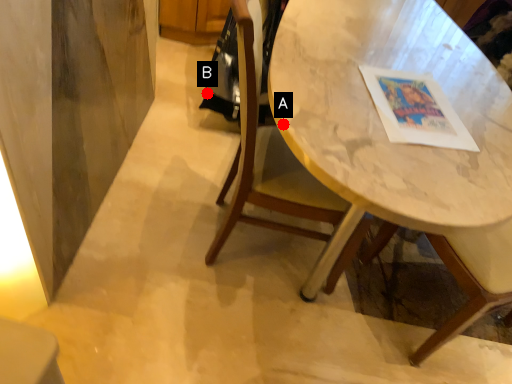
Question: Two points are circled on the image, labeled by A and B beside each circle. Which point is farther from the camera taking this photo?

Choices:
 (A) A is further
 (B) B is further

Answer: (B)